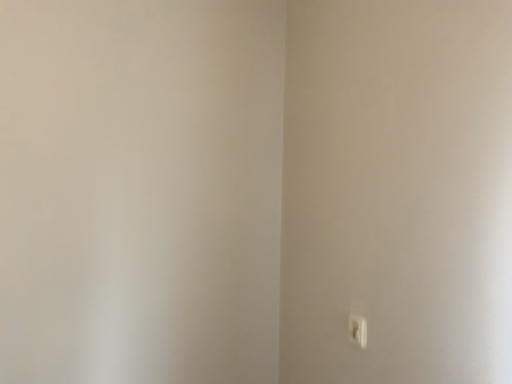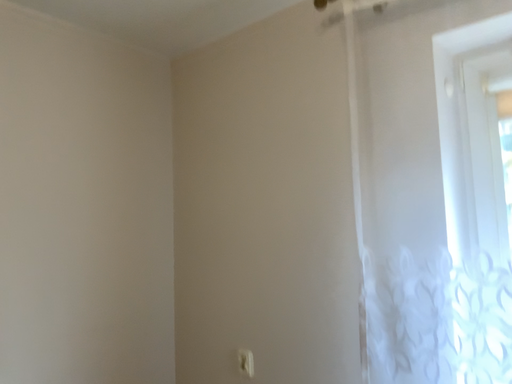
Question: Which way did the camera rotate in the video?

Choices:
 (A) rotated right
 (B) rotated left

Answer: (A)